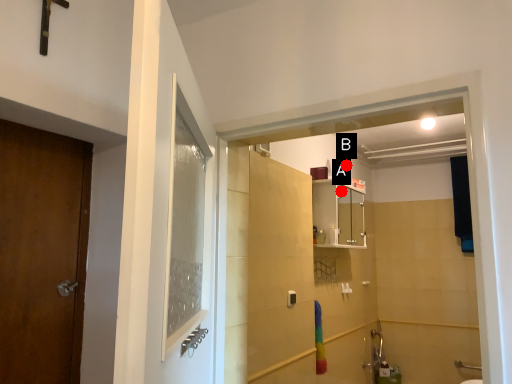
Question: Two points are circled on the image, labeled by A and B beside each circle. Which point is closer to the camera taking this photo?

Choices:
 (A) A is closer
 (B) B is closer

Answer: (A)